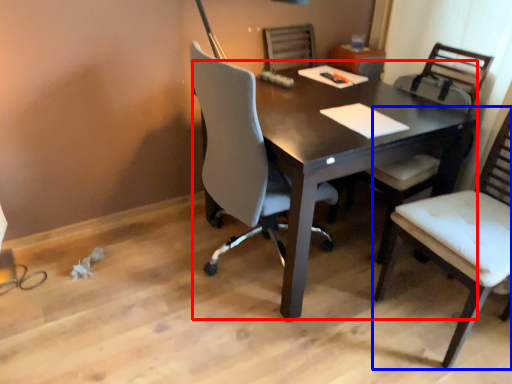
Question: Which of the following is the closest to the observer, desk (highlighted by a red box) or chair (highlighted by a blue box)?

Choices:
 (A) desk
 (B) chair

Answer: (B)